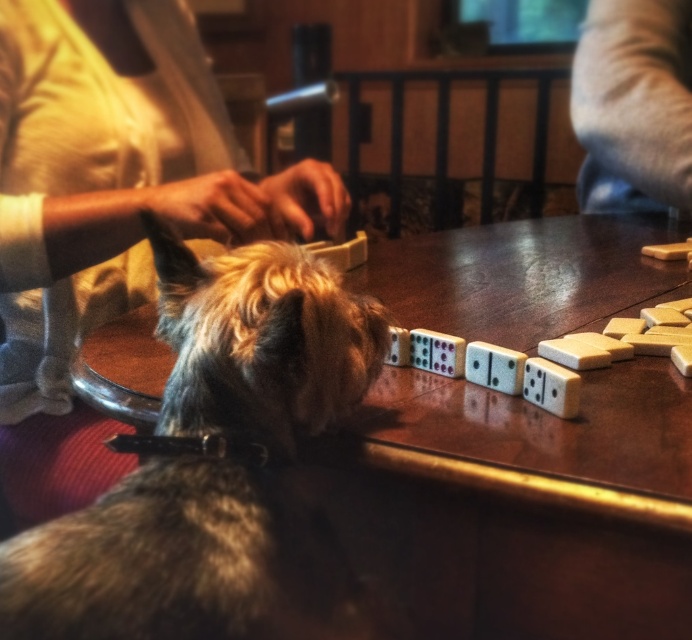
Is fuzzy fur dog at lower left shorter than gray fabric at upper right?

Yes.

Can you confirm if fuzzy fur dog at lower left is positioned below gray fabric at upper right?

Yes.

Is point (145, 531) positioned before point (689, 10)?

Yes, point (145, 531) is closer to viewer.

Where is `fuzzy fur dog at lower left`? fuzzy fur dog at lower left is located at coordinates (161, 561).